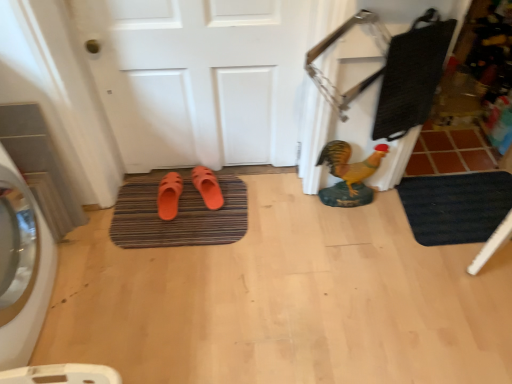
You are a GUI agent. You are given a task and a screenshot of the screen. Output one action in this format:
    pyautogui.click(x=<x>, y=<y>)
    Task: Click on the vacant space to the right of yellow matte chicken at center-right
    The height and width of the screenshot is (384, 512).
    Given the screenshot: What is the action you would take?
    pyautogui.click(x=386, y=211)